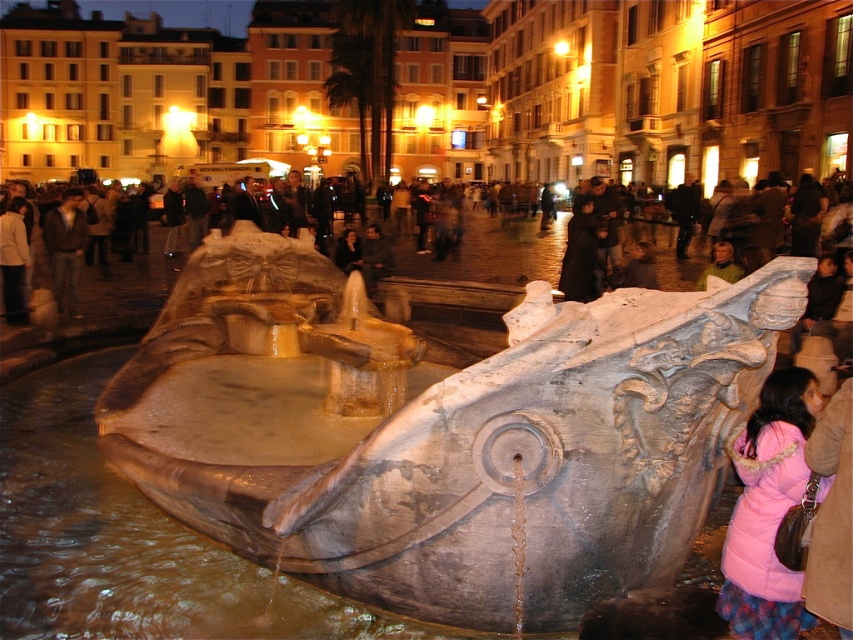
Can you confirm if pink puffy coat at lower right is positioned to the right of pink fabric coat at lower right?

Yes, pink puffy coat at lower right is to the right of pink fabric coat at lower right.

This screenshot has width=853, height=640. Describe the element at coordinates (769, 509) in the screenshot. I see `pink puffy coat at lower right` at that location.

In the scene shown: Who is more forward, (747, 451) or (672, 227)?

Point (747, 451)

I want to click on pink puffy coat at lower right, so click(769, 509).